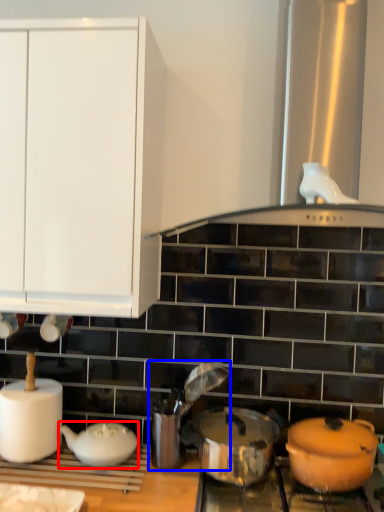
Question: Which point is closer to the camera, tableware (highlighted by a red box) or appliance (highlighted by a blue box)?

Choices:
 (A) tableware
 (B) appliance

Answer: (A)